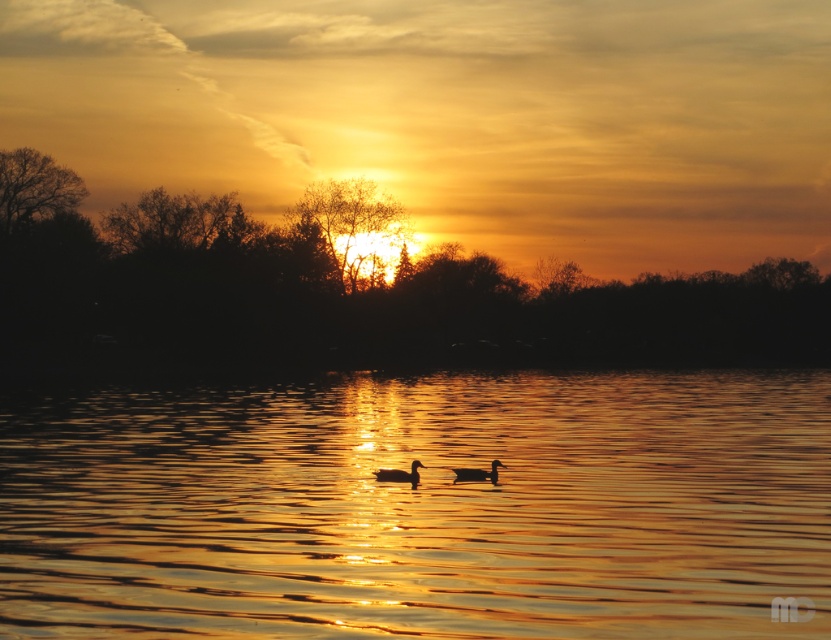
Question: Which point is farther from the camera taking this photo?

Choices:
 (A) (397, 481)
 (B) (94, 621)

Answer: (A)

Question: Estimate the real-world distances between objects in this image. Which object is farther from the matte black duck at center?

Choices:
 (A) glistening golden water at center
 (B) brown matte duck at center

Answer: (A)

Question: Does glistening golden water at center appear on the right side of brown matte duck at center?

Choices:
 (A) no
 (B) yes

Answer: (B)

Question: In this image, where is glistening golden water at center located relative to matte black duck at center?

Choices:
 (A) above
 (B) below

Answer: (B)

Question: Does glistening golden water at center appear on the left side of matte black duck at center?

Choices:
 (A) no
 (B) yes

Answer: (B)

Question: Among these objects, which one is nearest to the camera?

Choices:
 (A) matte black duck at center
 (B) glistening golden water at center

Answer: (B)